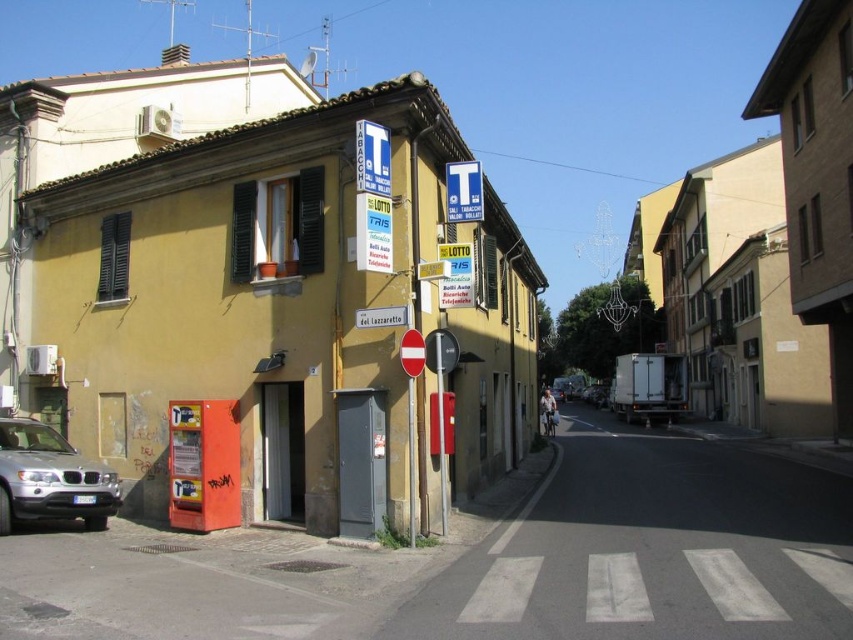
Question: Which of the following is the farthest from the observer?

Choices:
 (A) (78, 474)
 (B) (477, 572)

Answer: (A)

Question: In this image, where is concrete sidewalk at lower center located relative to silver metallic suv at lower left?

Choices:
 (A) above
 (B) below

Answer: (B)

Question: Is concrete sidewalk at lower center thinner than silver metallic suv at lower left?

Choices:
 (A) yes
 (B) no

Answer: (B)

Question: Is concrete sidewalk at lower center in front of silver metallic suv at lower left?

Choices:
 (A) yes
 (B) no

Answer: (A)